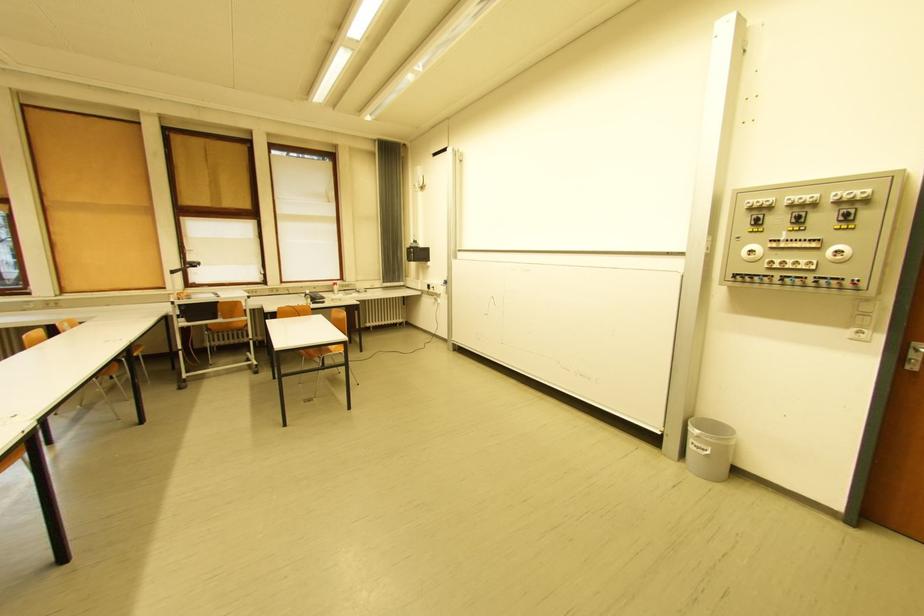
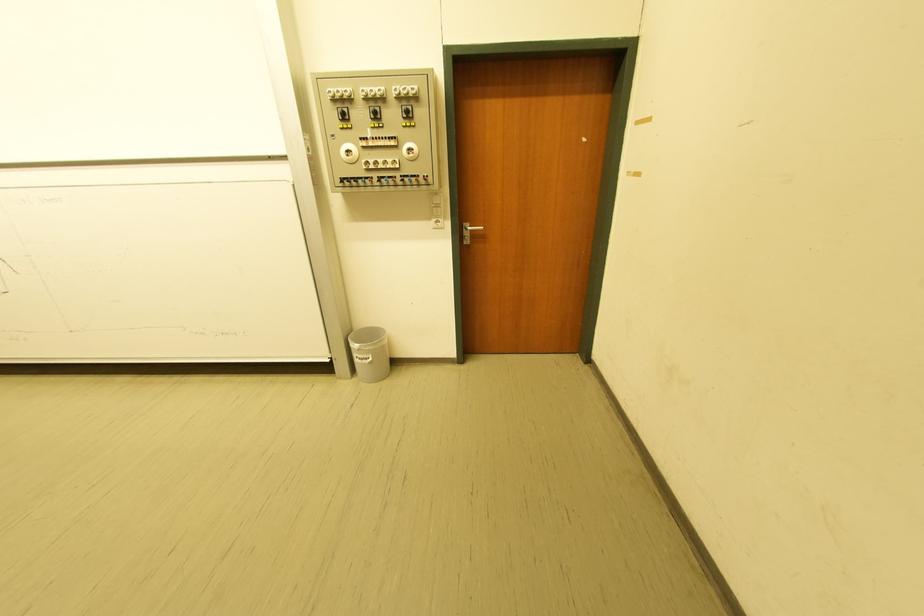
Locate, in the second image, the point that corresponds to pixel 852 208 in the first image.

(410, 103)